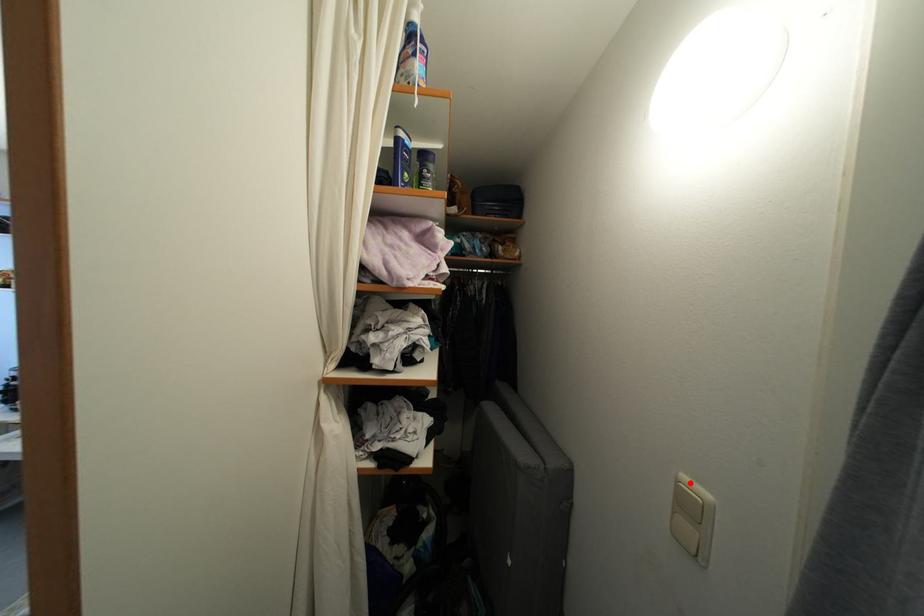
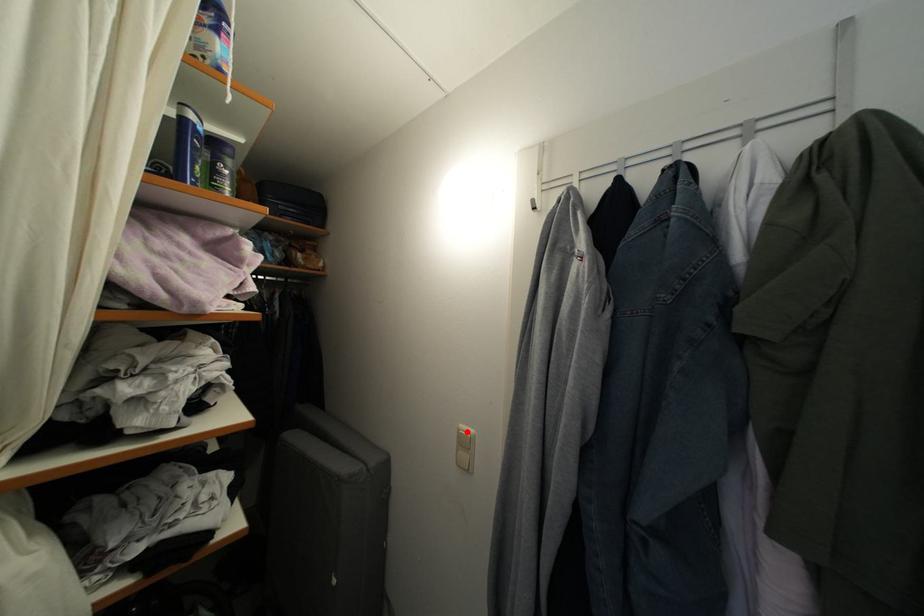
I am providing you with two images of the same scene from different viewpoints. A red point is marked on the first image and another point is marked on the second image. Are the points marked in image1 and image2 representing the same 3D position?

Yes